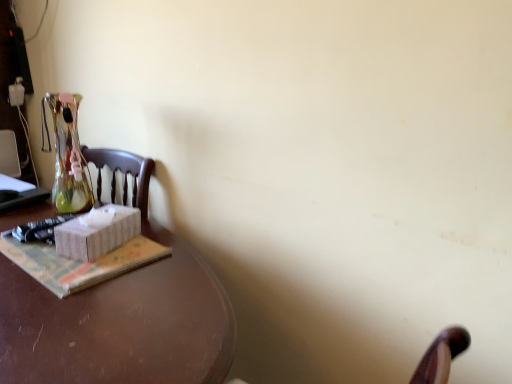
Question: Do you think white wicker box at left is within white paper at left, or outside of it?

Choices:
 (A) outside
 (B) inside

Answer: (A)

Question: In terms of width, does white wicker box at left look wider or thinner when compared to white paper at left?

Choices:
 (A) wide
 (B) thin

Answer: (B)

Question: Considering the real-world distances, which object is closest to the brown polished wood desk at left?

Choices:
 (A) white paper at left
 (B) white wicker box at left

Answer: (A)

Question: Based on their relative distances, which object is farther from the brown polished wood desk at left?

Choices:
 (A) white wicker box at left
 (B) white paper at left

Answer: (A)